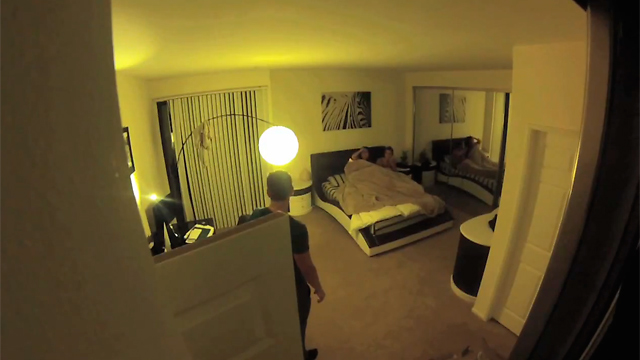
Identify the location of ceiling. This screenshot has height=360, width=640. (188, 46), (393, 33), (563, 24).